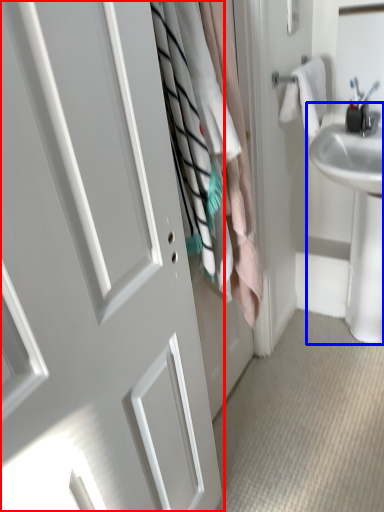
Question: Which object appears farthest to the camera in this image, door (highlighted by a red box) or sink (highlighted by a blue box)?

Choices:
 (A) door
 (B) sink

Answer: (B)